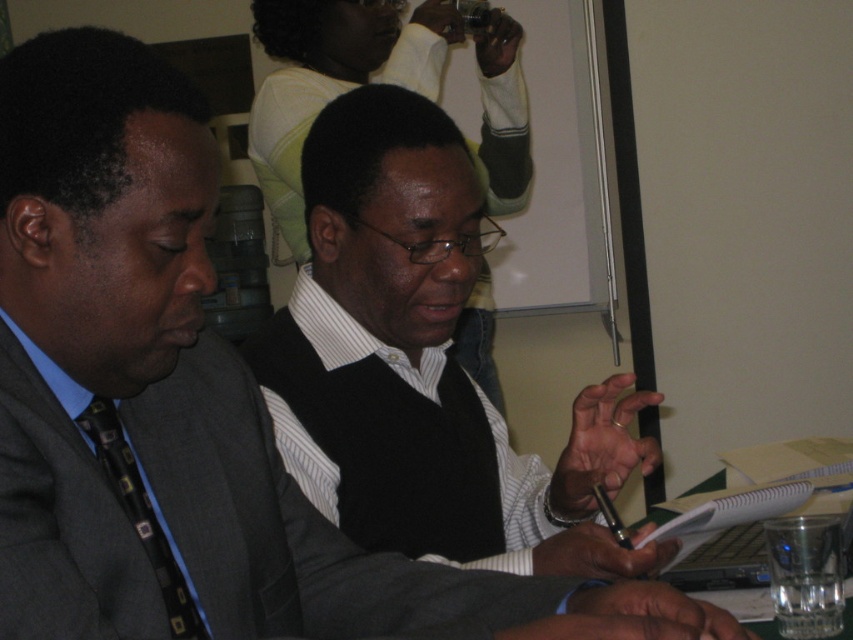
You are a photographer standing in the room where the black matte vest at center is part of the scene. You want to take a closeup photo of the vest without moving any objects. Can you position yourself within 3 feet to capture it?

The black matte vest at center is 35.42 inches away from the viewer. Since 35.42 inches is approximately 2.95 feet, you can position yourself within 3 feet to capture the black matte vest at center.

You are attending a meeting and need to determine which of the two points, point (451, 412) or point (173, 592), is closer to you. Based on the scene description, which point is nearer?

Point (451, 412) is closer to you because it is further to the viewer than point (173, 592).

Consider the image. You are a photographer who needs to take a closeup shot of the black matte vest at center. The camera you are using has a minimum focusing distance of 36 inches. Based on the scene description, can you successfully take the closeup shot?

The black matte vest at center and camera are 35.42 inches apart from each other. Since the minimum focusing distance is 36 inches, the camera cannot focus at 35.42 inches. Therefore, you cannot take the closeup shot.